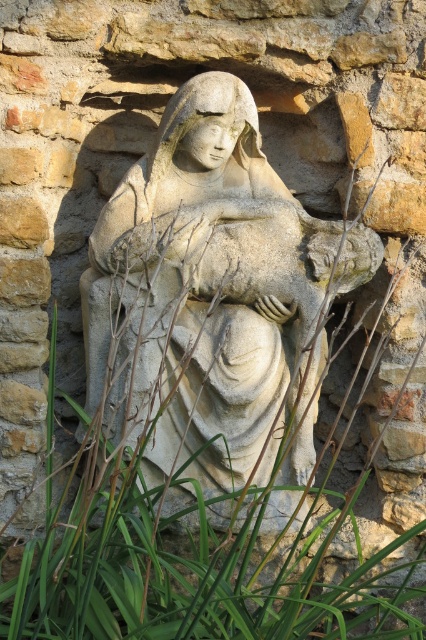
Does stone statue at center have a greater width compared to green leafy grass at center?

No.

Does stone statue at center have a larger size compared to green leafy grass at center?

No.

Who is more distant from viewer, (x=100, y=228) or (x=150, y=564)?

The point (x=100, y=228) is more distant.

At what (x,y) coordinates should I click in order to perform the action: click on stone statue at center. Please return your answer as a coordinate pair (x, y). The height and width of the screenshot is (640, 426). Looking at the image, I should click on (213, 298).